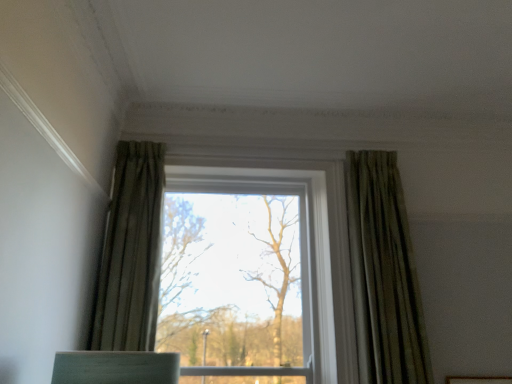
You are a GUI agent. You are given a task and a screenshot of the screen. Output one action in this format:
    pyautogui.click(x=<x>, y=<y>)
    Task: Click on the clear glass window at center
    This screenshot has width=512, height=384.
    Given the screenshot: What is the action you would take?
    pyautogui.click(x=383, y=274)

How much space does green textured curtain at right, which is the second curtain in left-to-right order, occupy horizontally?

green textured curtain at right, which is the second curtain in left-to-right order, is 6.60 inches wide.

Find the location of `green textured curtain at right, which is the second curtain in left-to-right order`. green textured curtain at right, which is the second curtain in left-to-right order is located at coordinates (383, 274).

Where is `clear glass window at center`? Image resolution: width=512 pixels, height=384 pixels. clear glass window at center is located at coordinates (383, 274).

Considering the points (415, 316) and (389, 320), which point is behind, point (415, 316) or point (389, 320)?

Point (415, 316)

From a real-world perspective, does green textured curtain at right, which ranks as the 1th curtain in right-to-left order, stand above clear glass window at center?

Indeed, from a real-world perspective, green textured curtain at right, which ranks as the 1th curtain in right-to-left order, stands above clear glass window at center.

What are the coordinates of `curtain that is the 1st one when counting forward from the clear glass window at center` in the screenshot? It's located at (383, 274).

Is green textured curtain at right, which ranks as the 1th curtain in right-to-left order, next to green textured curtain at left, the 1th curtain from the left?

No, green textured curtain at right, which ranks as the 1th curtain in right-to-left order, is not making contact with green textured curtain at left, the 1th curtain from the left.

Is green textured curtain at right, which is the second curtain in left-to-right order, positioned in front of green textured curtain at left, the 1th curtain from the left?

No, green textured curtain at right, which is the second curtain in left-to-right order, is behind green textured curtain at left, the 1th curtain from the left.

Is green textured curtain at right, which ranks as the 1th curtain in right-to-left order, taller than green textured curtain at left, the 1th curtain from the left?

Yes, green textured curtain at right, which ranks as the 1th curtain in right-to-left order, is taller than green textured curtain at left, the 1th curtain from the left.

This screenshot has height=384, width=512. I want to click on window below the green textured curtain at left, which is the second curtain from right to left (from the image's perspective), so click(x=383, y=274).

Is clear glass window at center outside of green textured curtain at left, which is the second curtain from right to left?

Yes, clear glass window at center is located beyond the bounds of green textured curtain at left, which is the second curtain from right to left.

From a real-world perspective, relative to green textured curtain at left, the 1th curtain from the left, is clear glass window at center vertically above or below?

From a real-world perspective, clear glass window at center is physically below green textured curtain at left, the 1th curtain from the left.

From the picture: How different are the orientations of green textured curtain at left, which is the second curtain from right to left, and clear glass window at center in degrees?

The facing directions of green textured curtain at left, which is the second curtain from right to left, and clear glass window at center are 0.0182 degrees apart.

Between green textured curtain at left, the 1th curtain from the left, and clear glass window at center, which one has larger width?

With larger width is clear glass window at center.

Considering their positions, is green textured curtain at left, which is the second curtain from right to left, located in front of or behind clear glass window at center?

green textured curtain at left, which is the second curtain from right to left, is in front of clear glass window at center.

Are green textured curtain at left, which is the second curtain from right to left, and clear glass window at center making contact?

green textured curtain at left, which is the second curtain from right to left, and clear glass window at center are clearly separated.

From a real-world perspective, which is physically above, clear glass window at center or green textured curtain at right, which ranks as the 1th curtain in right-to-left order?

green textured curtain at right, which ranks as the 1th curtain in right-to-left order, from a real-world perspective.

Which point is more distant from viewer, (x=123, y=285) or (x=370, y=366)?

The point (x=370, y=366) is behind.

Does clear glass window at center have a smaller size compared to green textured curtain at right, which is the second curtain in left-to-right order?

Actually, clear glass window at center might be larger than green textured curtain at right, which is the second curtain in left-to-right order.

Which is more to the right, clear glass window at center or green textured curtain at right, which ranks as the 1th curtain in right-to-left order?

From the viewer's perspective, green textured curtain at right, which ranks as the 1th curtain in right-to-left order, appears more on the right side.

Does green textured curtain at left, which is the second curtain from right to left, appear on the left side of green textured curtain at right, which ranks as the 1th curtain in right-to-left order?

Indeed, green textured curtain at left, which is the second curtain from right to left, is positioned on the left side of green textured curtain at right, which ranks as the 1th curtain in right-to-left order.

Relative to green textured curtain at right, which is the second curtain in left-to-right order, is green textured curtain at left, the 1th curtain from the left, in front or behind?

In the image, green textured curtain at left, the 1th curtain from the left, appears in front of green textured curtain at right, which is the second curtain in left-to-right order.

From a real-world perspective, relative to green textured curtain at right, which ranks as the 1th curtain in right-to-left order, is green textured curtain at left, the 1th curtain from the left, vertically above or below?

green textured curtain at left, the 1th curtain from the left, is situated higher than green textured curtain at right, which ranks as the 1th curtain in right-to-left order, in the real world.

Does point (132, 155) come closer to viewer compared to point (362, 284)?

No.

This screenshot has height=384, width=512. Find the location of `curtain on the right of clear glass window at center`. curtain on the right of clear glass window at center is located at coordinates (383, 274).

I want to click on curtain below the green textured curtain at left, the 1th curtain from the left (from the image's perspective), so click(x=383, y=274).

Which object lies nearer to the anchor point green textured curtain at right, which is the second curtain in left-to-right order, clear glass window at center or green textured curtain at left, the 1th curtain from the left?

Among the two, clear glass window at center is located nearer to green textured curtain at right, which is the second curtain in left-to-right order.

Looking at the image, which one is located further to green textured curtain at left, the 1th curtain from the left, clear glass window at center or green textured curtain at right, which is the second curtain in left-to-right order?

green textured curtain at right, which is the second curtain in left-to-right order, is positioned further to the anchor green textured curtain at left, the 1th curtain from the left.

Considering their positions, is green textured curtain at right, which ranks as the 1th curtain in right-to-left order, positioned further to green textured curtain at left, which is the second curtain from right to left, than clear glass window at center?

Among the two, green textured curtain at right, which ranks as the 1th curtain in right-to-left order, is located further to green textured curtain at left, which is the second curtain from right to left.

From the image, which object appears to be nearer to clear glass window at center, green textured curtain at left, the 1th curtain from the left, or green textured curtain at right, which ranks as the 1th curtain in right-to-left order?

green textured curtain at right, which ranks as the 1th curtain in right-to-left order.

From the image, which object appears to be farther from green textured curtain at right, which ranks as the 1th curtain in right-to-left order, green textured curtain at left, which is the second curtain from right to left, or clear glass window at center?

green textured curtain at left, which is the second curtain from right to left, lies further to green textured curtain at right, which ranks as the 1th curtain in right-to-left order, than the other object.

From the image, which object appears to be farther from clear glass window at center, green textured curtain at right, which is the second curtain in left-to-right order, or green textured curtain at left, the 1th curtain from the left?

green textured curtain at left, the 1th curtain from the left, is positioned further to the anchor clear glass window at center.

Where is `window between green textured curtain at left, the 1th curtain from the left, and green textured curtain at right, which is the second curtain in left-to-right order, from left to right`? window between green textured curtain at left, the 1th curtain from the left, and green textured curtain at right, which is the second curtain in left-to-right order, from left to right is located at coordinates [383, 274].